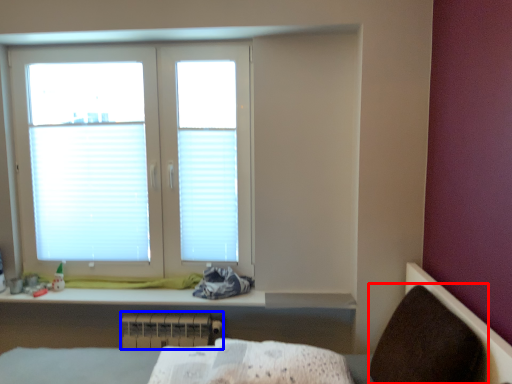
Question: Among these objects, which one is farthest to the camera, armchair (highlighted by a red box) or radiator (highlighted by a blue box)?

Choices:
 (A) armchair
 (B) radiator

Answer: (B)